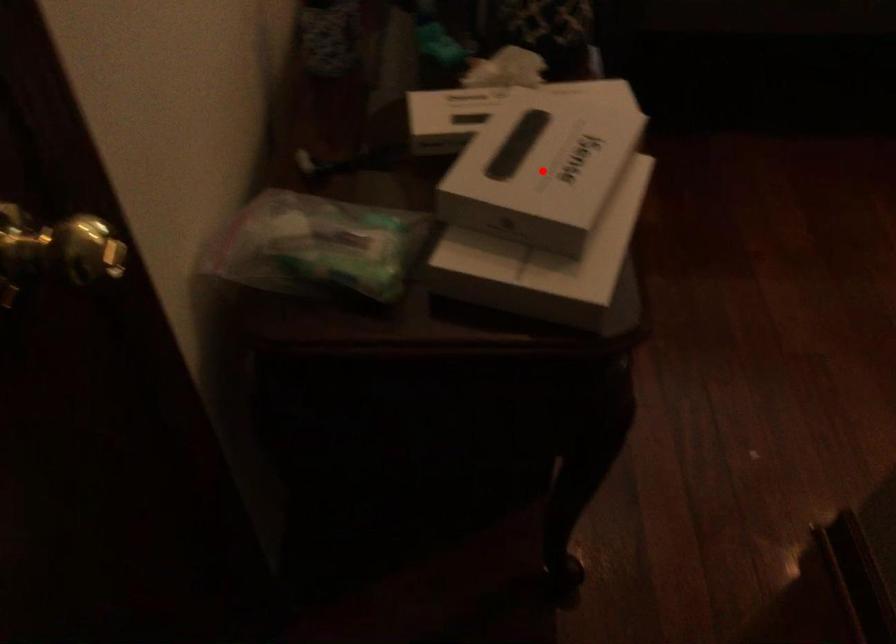
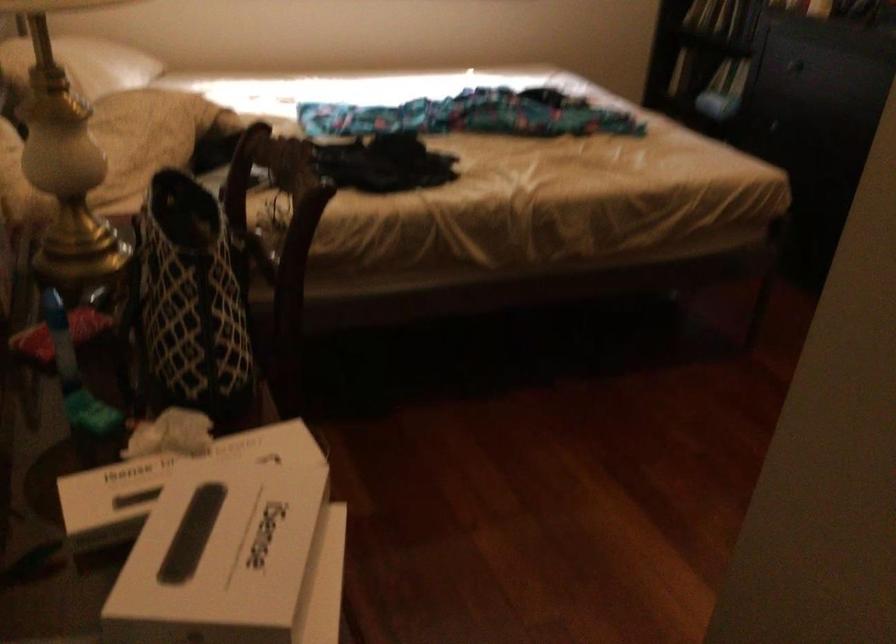
Question: I am providing you with two images of the same scene from different viewpoints. A red point is marked on the first image. Can you still see the location of the red point in image 2?

Choices:
 (A) Yes
 (B) No

Answer: (A)